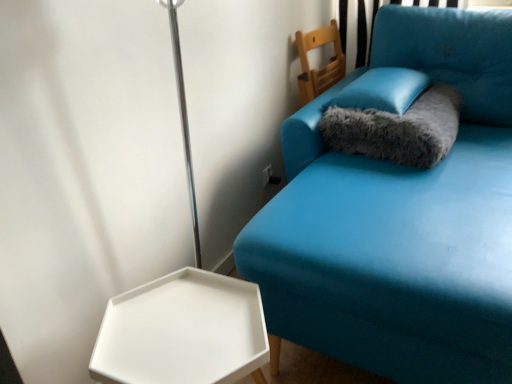
Question: Is white matte hexagonal tray at lower left aimed at fuzzy gray cat bed at upper right?

Choices:
 (A) no
 (B) yes

Answer: (A)

Question: Can you confirm if white matte hexagonal tray at lower left is positioned to the left of fuzzy gray cat bed at upper right?

Choices:
 (A) no
 (B) yes

Answer: (B)

Question: From the image's perspective, is white matte hexagonal tray at lower left below fuzzy gray cat bed at upper right?

Choices:
 (A) yes
 (B) no

Answer: (A)

Question: Can you confirm if white matte hexagonal tray at lower left is thinner than fuzzy gray cat bed at upper right?

Choices:
 (A) no
 (B) yes

Answer: (B)

Question: Is white matte hexagonal tray at lower left positioned before fuzzy gray cat bed at upper right?

Choices:
 (A) no
 (B) yes

Answer: (B)

Question: Is fuzzy gray cat bed at upper right at the back of white matte hexagonal tray at lower left?

Choices:
 (A) yes
 (B) no

Answer: (B)

Question: Is fuzzy gray cat bed at upper right aimed at satin blue pillow at upper right?

Choices:
 (A) no
 (B) yes

Answer: (A)

Question: Is fuzzy gray cat bed at upper right closer to the viewer compared to satin blue pillow at upper right?

Choices:
 (A) yes
 (B) no

Answer: (A)

Question: Can you confirm if fuzzy gray cat bed at upper right is wider than satin blue pillow at upper right?

Choices:
 (A) no
 (B) yes

Answer: (A)

Question: From a real-world perspective, is fuzzy gray cat bed at upper right located beneath satin blue pillow at upper right?

Choices:
 (A) yes
 (B) no

Answer: (A)

Question: From a real-world perspective, is fuzzy gray cat bed at upper right located higher than satin blue pillow at upper right?

Choices:
 (A) no
 (B) yes

Answer: (A)

Question: Are fuzzy gray cat bed at upper right and satin blue pillow at upper right located far from each other?

Choices:
 (A) yes
 (B) no

Answer: (B)

Question: Is the depth of white matte hexagonal tray at lower left less than that of teal fabric couch at upper right?

Choices:
 (A) yes
 (B) no

Answer: (B)